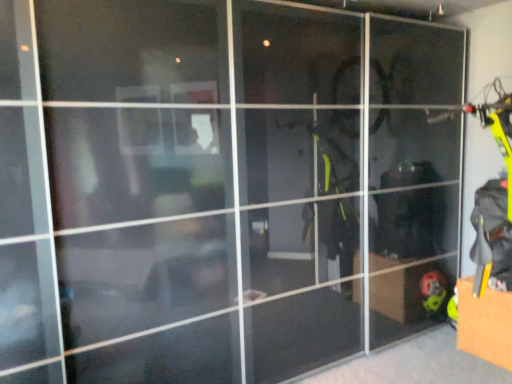
This screenshot has height=384, width=512. What do you see at coordinates (485, 323) in the screenshot? I see `brown cardboard box at lower right` at bounding box center [485, 323].

What are the coordinates of `brown cardboard box at lower right` in the screenshot? It's located at (485, 323).

Measure the distance between brown cardboard box at lower right and camera.

brown cardboard box at lower right and camera are 8.97 feet apart from each other.

At what (x,y) coordinates should I click in order to perform the action: click on brown cardboard box at lower right. Please return your answer as a coordinate pair (x, y). The image size is (512, 384). Looking at the image, I should click on (485, 323).